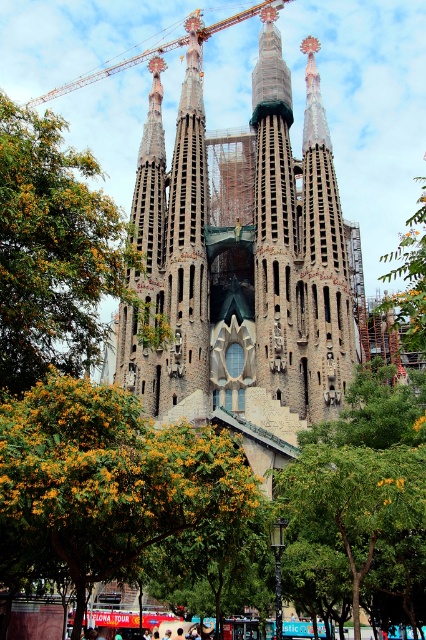
The image size is (426, 640). Find the location of `green leafy tree at upper right`. green leafy tree at upper right is located at coordinates (409, 276).

Does green leafy tree at upper right have a smaller size compared to metallic construction crane at upper left?

Actually, green leafy tree at upper right might be larger than metallic construction crane at upper left.

Does point (406, 276) come farther from viewer compared to point (126, 60)?

That is False.

Locate an element on the screen. The image size is (426, 640). green leafy tree at upper right is located at coordinates (409, 276).

From the picture: Who is more distant from viewer, (178, 296) or (414, 317)?

Point (178, 296)

Does brown stone church at center have a smaller size compared to green leafy tree at upper right?

No, brown stone church at center is not smaller than green leafy tree at upper right.

Is point (163, 260) positioned before point (420, 305)?

No, it is not.

The image size is (426, 640). In order to click on brown stone church at center in this screenshot , I will do `click(241, 253)`.

Measure the distance between brown stone church at center and camera.

They are 65.76 meters apart.

Can you confirm if brown stone church at center is taller than yellow-green leaves at center?

Yes.

Locate an element on the screen. The height and width of the screenshot is (640, 426). brown stone church at center is located at coordinates (241, 253).

Where is `brown stone church at center`? The height and width of the screenshot is (640, 426). brown stone church at center is located at coordinates (241, 253).